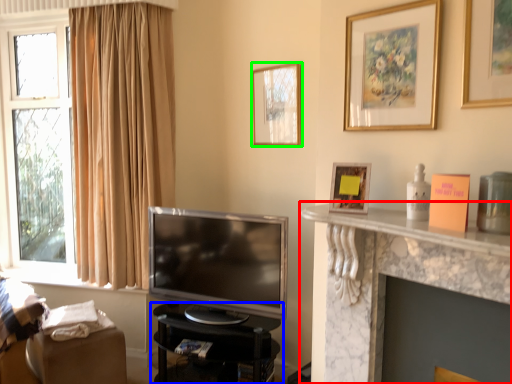
Question: Which is farther away from shelf (highlighted by a red box)? furniture (highlighted by a blue box) or picture frame (highlighted by a green box)?

Choices:
 (A) furniture
 (B) picture frame

Answer: (B)